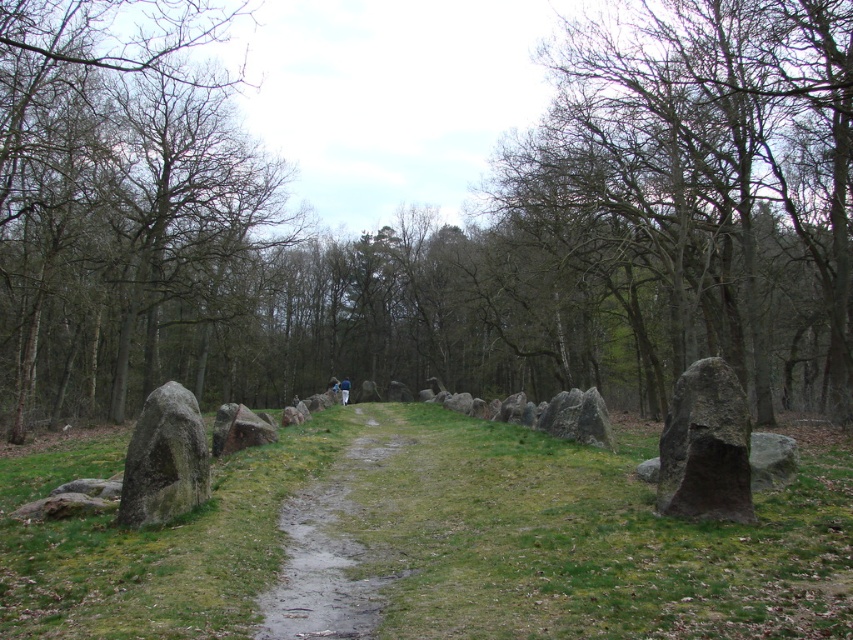
Question: Which of the following is the closest to the observer?

Choices:
 (A) (x=843, y=292)
 (B) (x=349, y=502)

Answer: (B)

Question: Which point is closer to the camera?

Choices:
 (A) damp dirt path at center
 (B) gray stone boulder at left
 (C) blue fabric person at center

Answer: (A)

Question: Can you confirm if dark gray stone at right is wider than gray stone boulder at left?

Choices:
 (A) no
 (B) yes

Answer: (A)

Question: Can you confirm if smooth brown tree trunk at left is smaller than damp dirt path at center?

Choices:
 (A) yes
 (B) no

Answer: (B)

Question: Estimate the real-world distances between objects in this image. Which object is farther from the green grassy at center?

Choices:
 (A) smooth brown tree trunk at left
 (B) damp dirt path at center

Answer: (A)

Question: Where is smooth stone forest at center located in relation to damp dirt path at center in the image?

Choices:
 (A) left
 (B) right

Answer: (A)